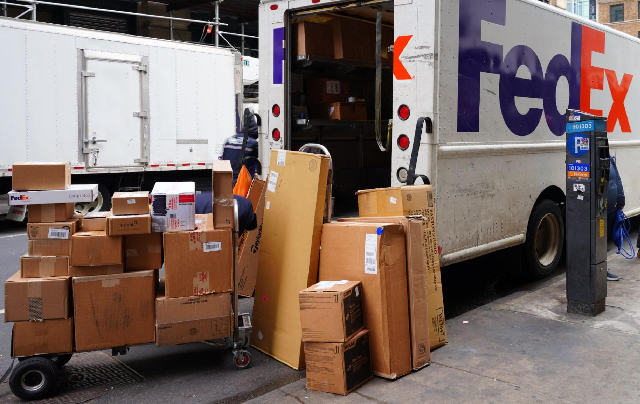
Where is `box`? box is located at coordinates (324, 232).